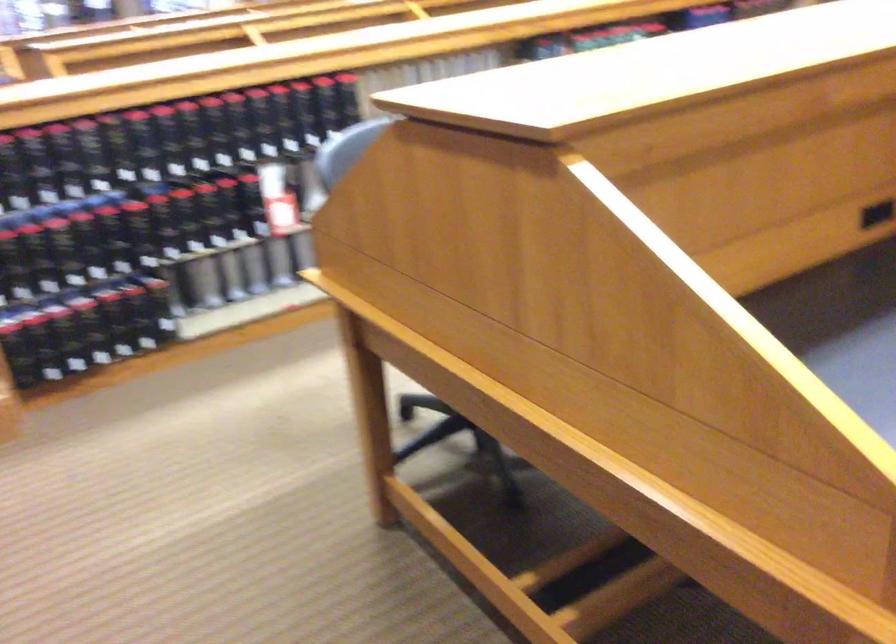
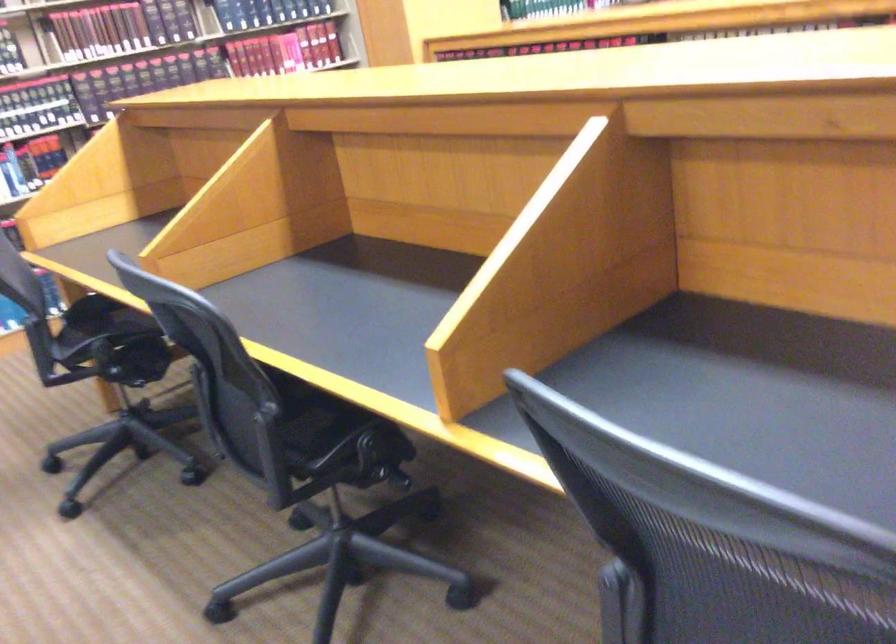
Question: I am providing you with two images of the same scene from different viewpoints. Please identify which objects are invisible in image2.

Choices:
 (A) chair sitting surface
 (B) black binder
 (C) white back pillow
 (D) hardcover book

Answer: (B)